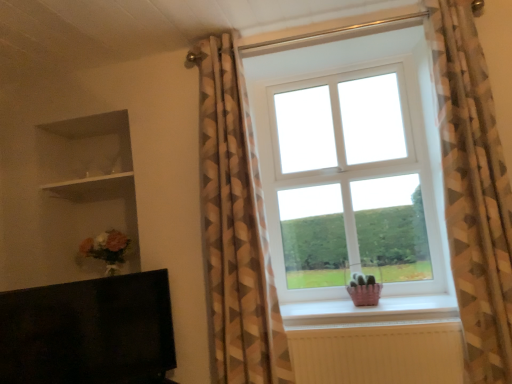
Question: In the image, is geometric-patterned curtain at center, which appears as the 2th curtain when viewed from the right, positioned in front of or behind matte pink basket at lower center?

Choices:
 (A) front
 (B) behind

Answer: (A)

Question: From a real-world perspective, relative to matte pink basket at lower center, is geometric-patterned curtain at center, which appears as the 2th curtain when viewed from the right, vertically above or below?

Choices:
 (A) below
 (B) above

Answer: (B)

Question: Which is farther from the white plastic window at center?

Choices:
 (A) black matte tv at lower left
 (B) matte pink basket at lower center
 (C) geometric-patterned curtain at right, which is the second curtain from left to right
 (D) geometric-patterned curtain at center, which appears as the 2th curtain when viewed from the right
 (E) white glossy shelf at upper left

Answer: (E)

Question: Based on their relative distances, which object is nearer to the matte pink basket at lower center?

Choices:
 (A) white glossy shelf at upper left
 (B) geometric-patterned curtain at center, which appears as the 2th curtain when viewed from the right
 (C) geometric-patterned curtain at right, the first curtain positioned from the right
 (D) black matte tv at lower left
 (E) white plastic window at center

Answer: (E)